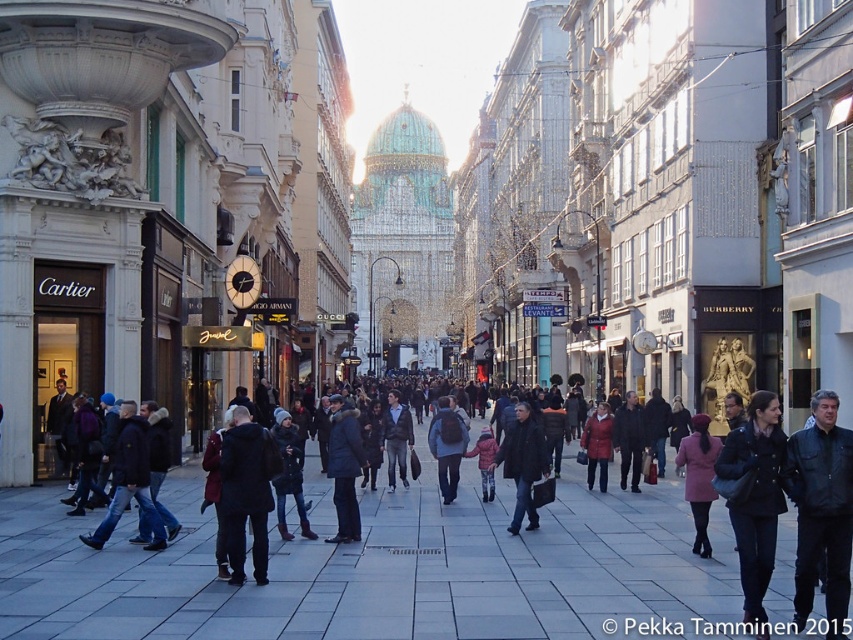
Describe the element at coordinates (129, 481) in the screenshot. I see `dark blue jacket at lower left` at that location.

Between point (149, 522) and point (401, 472), which one is positioned in front?

Point (149, 522)

Does point (123, 451) come closer to viewer compared to point (393, 468)?

Yes, point (123, 451) is in front of point (393, 468).

You are a GUI agent. You are given a task and a screenshot of the screen. Output one action in this format:
    pyautogui.click(x=<x>, y=<y>)
    Task: Click on the dark blue jacket at lower left
    
    Given the screenshot: What is the action you would take?
    pyautogui.click(x=129, y=481)

Is dark gray jacket at center closer to the viewer compared to matte red coat at center?

No, dark gray jacket at center is further to the viewer.

Which is more to the right, dark gray jacket at center or matte red coat at center?

matte red coat at center

This screenshot has height=640, width=853. Identify the location of dark gray jacket at center. (396, 436).

Which is above, dark blue jacket at lower left or dark gray wool coat at center?

Positioned higher is dark gray wool coat at center.

Does dark blue jacket at lower left appear over dark gray wool coat at center?

Incorrect, dark blue jacket at lower left is not positioned above dark gray wool coat at center.

I want to click on dark blue jacket at lower left, so click(x=129, y=481).